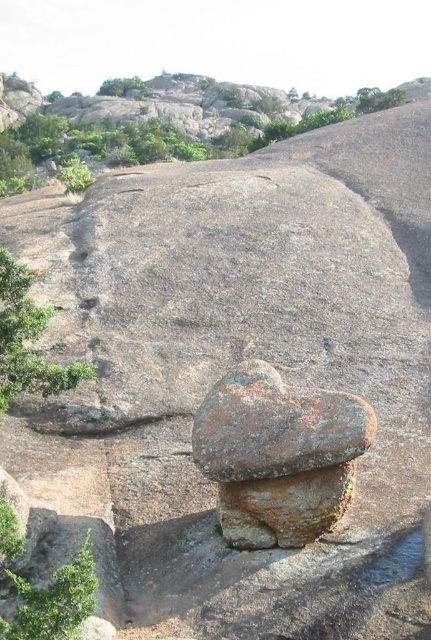
Question: Is rusty stone mushroom at center wider than green leafy tree at upper left?

Choices:
 (A) yes
 (B) no

Answer: (B)

Question: Which is farther from the green leafy tree at upper left?

Choices:
 (A) green leafy tree at lower left
 (B) green leafy tree at left

Answer: (A)

Question: Can you confirm if green leafy tree at left is wider than green leafy tree at lower left?

Choices:
 (A) yes
 (B) no

Answer: (A)

Question: Which point is closer to the camera taking this photo?

Choices:
 (A) (330, 440)
 (B) (105, 92)
 (C) (56, 605)

Answer: (C)

Question: Is green leafy tree at left positioned behind green leafy tree at upper left?

Choices:
 (A) no
 (B) yes

Answer: (A)

Question: Which object is positioned closest to the green leafy tree at upper left?

Choices:
 (A) green leafy tree at left
 (B) green leafy tree at lower left
 (C) rusty stone mushroom at center

Answer: (C)